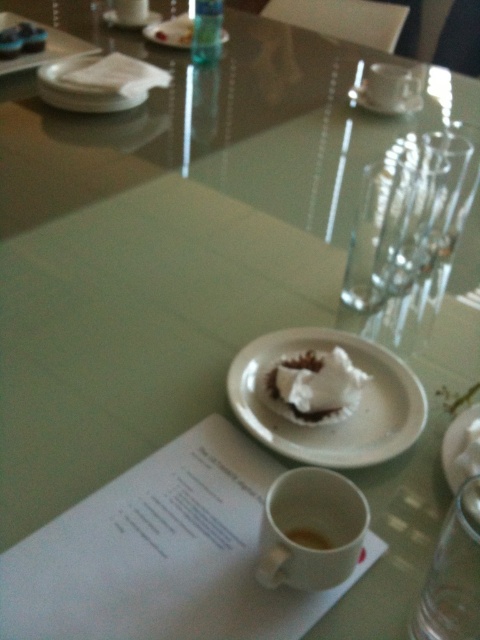
Between point (300, 428) and point (431, 620), which one is positioned in front?

Point (431, 620) is in front.

Consider the image. Can you confirm if white matte plate at center is taller than transparent glass at lower right?

Yes, white matte plate at center is taller than transparent glass at lower right.

Between point (375, 387) and point (429, 609), which one is positioned behind?

Point (375, 387)

You are a GUI agent. You are given a task and a screenshot of the screen. Output one action in this format:
    pyautogui.click(x=<x>, y=<y>)
    Task: Click on the white matte plate at center
    
    Given the screenshot: What is the action you would take?
    pyautogui.click(x=338, y=422)

Can you confirm if white matte plate at center is shorter than translucent glass bottle at upper center?

In fact, white matte plate at center may be taller than translucent glass bottle at upper center.

Is white matte plate at center smaller than translucent glass bottle at upper center?

Incorrect, white matte plate at center is not smaller in size than translucent glass bottle at upper center.

Between point (229, 365) and point (201, 12), which one is positioned behind?

Point (201, 12)

Where is `white matte plate at center`? This screenshot has width=480, height=640. white matte plate at center is located at coordinates click(x=338, y=422).

Is point (439, 580) positioned in front of point (339, 364)?

Yes.

Between point (456, 545) and point (312, 403), which one is positioned behind?

Positioned behind is point (312, 403).

The width and height of the screenshot is (480, 640). I want to click on transparent glass at lower right, so click(453, 573).